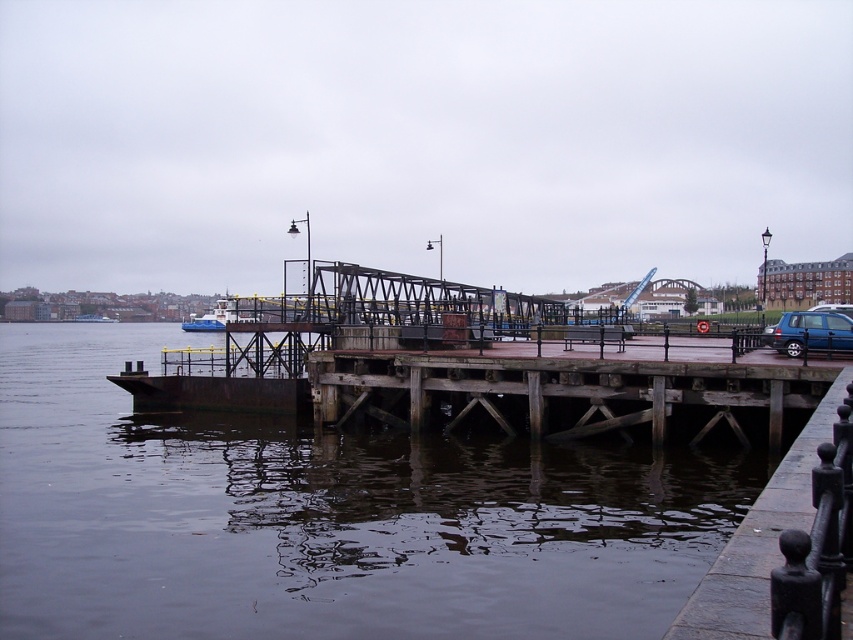
Can you confirm if dark gray water at lower left is positioned to the right of blue matte boat at left?

Correct, you'll find dark gray water at lower left to the right of blue matte boat at left.

Is point (663, 502) less distant than point (223, 310)?

Yes, point (663, 502) is closer to viewer.

Find the location of a particular element. This screenshot has width=853, height=640. dark gray water at lower left is located at coordinates (326, 516).

Where is `dark gray water at lower left`? This screenshot has width=853, height=640. dark gray water at lower left is located at coordinates (326, 516).

Consider the image. Which is above, blue metallic van at right or blue matte boat at left?

blue matte boat at left is higher up.

Is blue metallic van at right to the right of blue matte boat at left from the viewer's perspective?

Correct, you'll find blue metallic van at right to the right of blue matte boat at left.

In order to click on blue metallic van at right in this screenshot , I will do `click(810, 332)`.

Does point (370, 401) lie behind point (849, 321)?

No.

Does rusty metal bridge at center appear over blue metallic van at right?

No.

Does point (492, 428) come farther from viewer compared to point (801, 342)?

No, (492, 428) is in front of (801, 342).

This screenshot has height=640, width=853. Find the location of `rusty metal bridge at center`. rusty metal bridge at center is located at coordinates (560, 394).